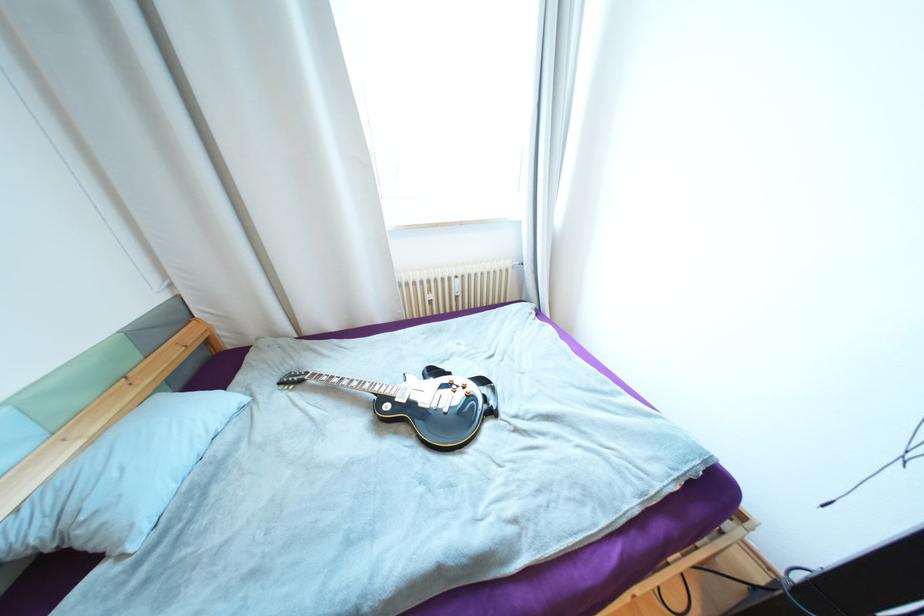
Where would you turn the guitar control knob? Please return your answer as a coordinate pair (x, y).

(456, 385)